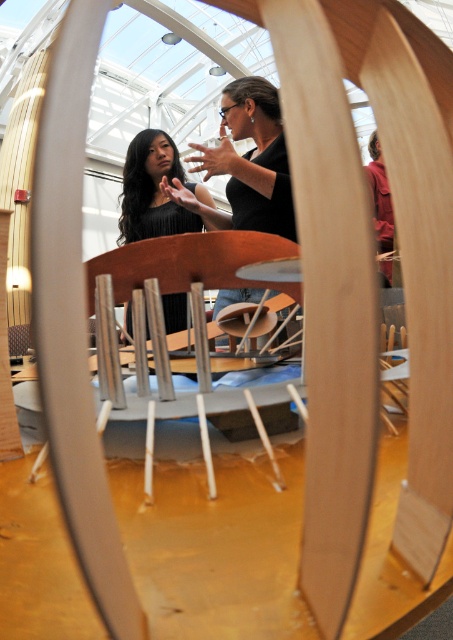
Question: Can you confirm if black matte shirt at center is positioned to the right of black matte dress at center?

Choices:
 (A) no
 (B) yes

Answer: (B)

Question: Which of the following is the farthest from the observer?

Choices:
 (A) black matte shirt at center
 (B) black matte dress at center

Answer: (B)

Question: Which of the following is the closest to the observer?

Choices:
 (A) black matte shirt at center
 (B) black matte dress at center

Answer: (A)

Question: Is black matte shirt at center positioned before black matte dress at center?

Choices:
 (A) no
 (B) yes

Answer: (B)

Question: Is black matte shirt at center positioned before black matte dress at center?

Choices:
 (A) no
 (B) yes

Answer: (B)